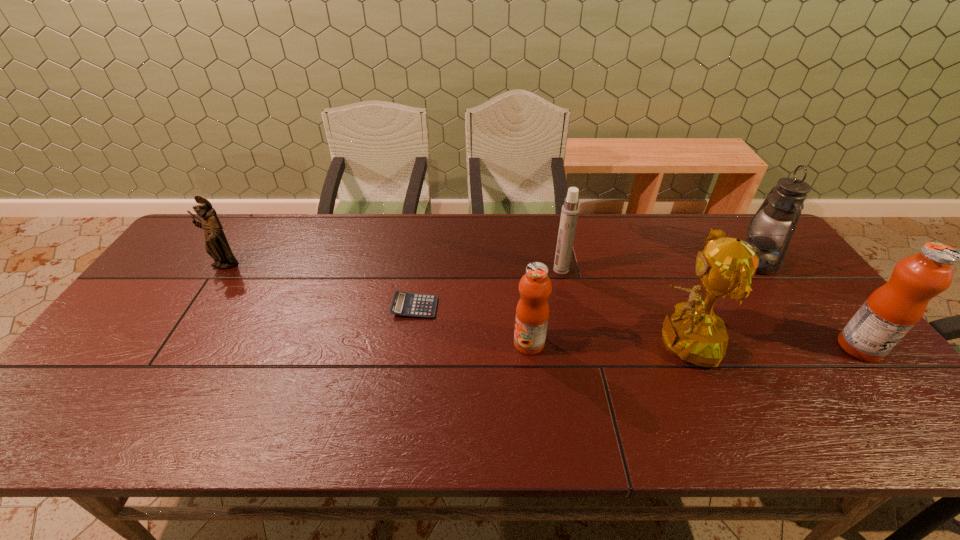
The height and width of the screenshot is (540, 960). I want to click on vacant spot to place a fruit juice on the left, so click(x=204, y=339).